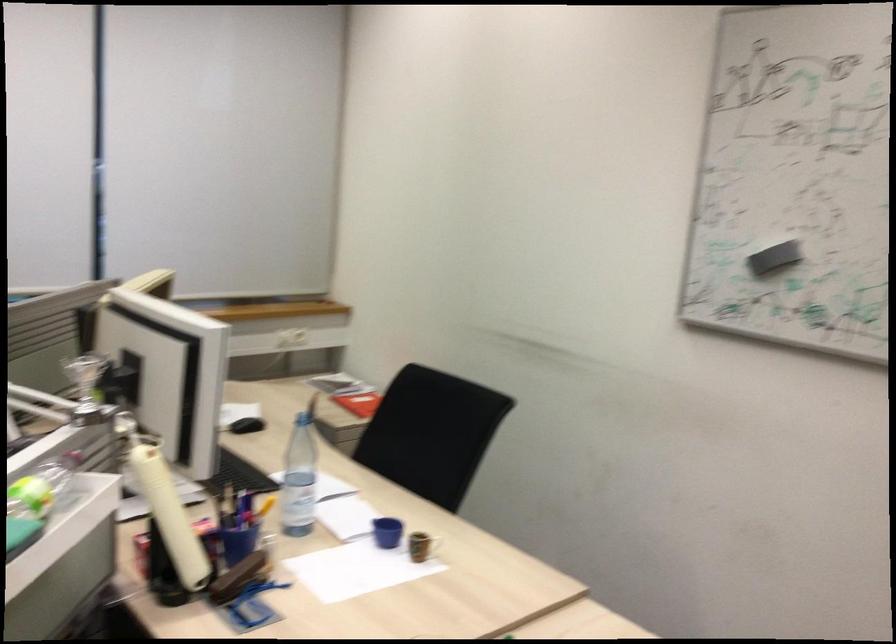
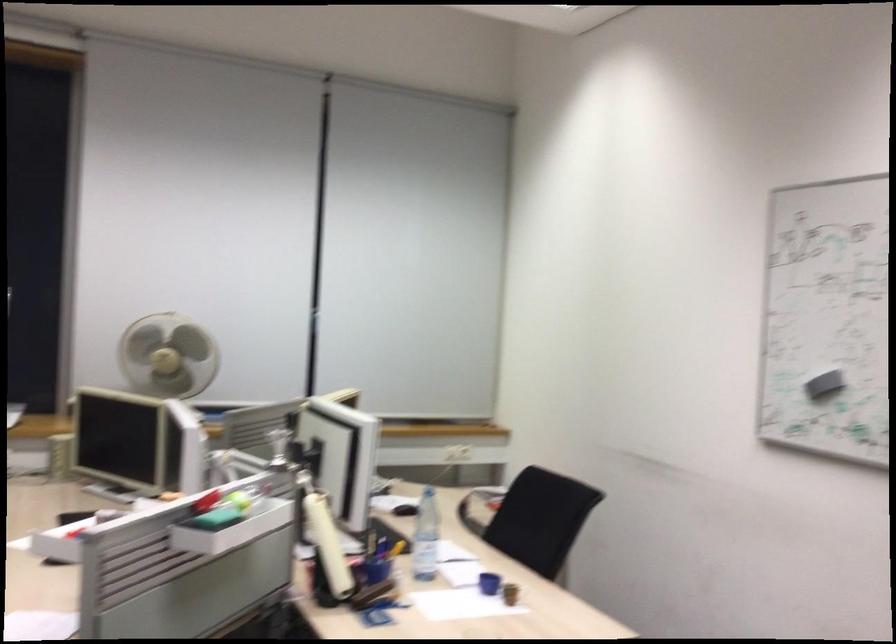
Where in the second image is the point corresponding to [306,478] from the first image?

(426, 536)